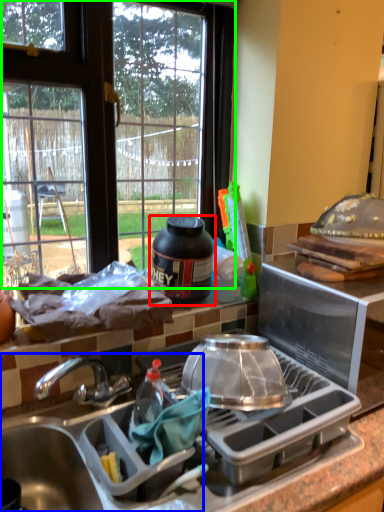
Question: Which object is the closest to the kitchen appliance (highlighted by a red box)? Choose among these: sink (highlighted by a blue box) or window (highlighted by a green box).

Choices:
 (A) sink
 (B) window

Answer: (A)